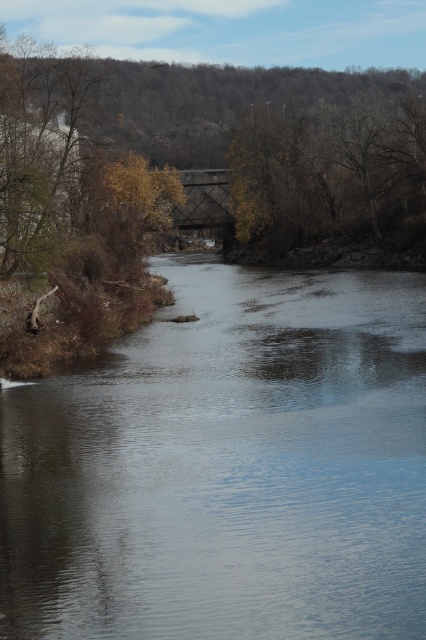
Question: Which point is closer to the camera?

Choices:
 (A) clear water at center
 (B) brown leafy tree at upper center

Answer: (A)

Question: In this image, where is clear water at center located relative to brown leafy tree at upper center?

Choices:
 (A) right
 (B) left

Answer: (B)

Question: Which of the following is the closest to the observer?

Choices:
 (A) brown leafy tree at upper center
 (B) clear water at center

Answer: (B)

Question: Is clear water at center positioned behind brown leafy tree at upper center?

Choices:
 (A) no
 (B) yes

Answer: (A)

Question: Is clear water at center closer to camera compared to brown leafy tree at upper center?

Choices:
 (A) no
 (B) yes

Answer: (B)